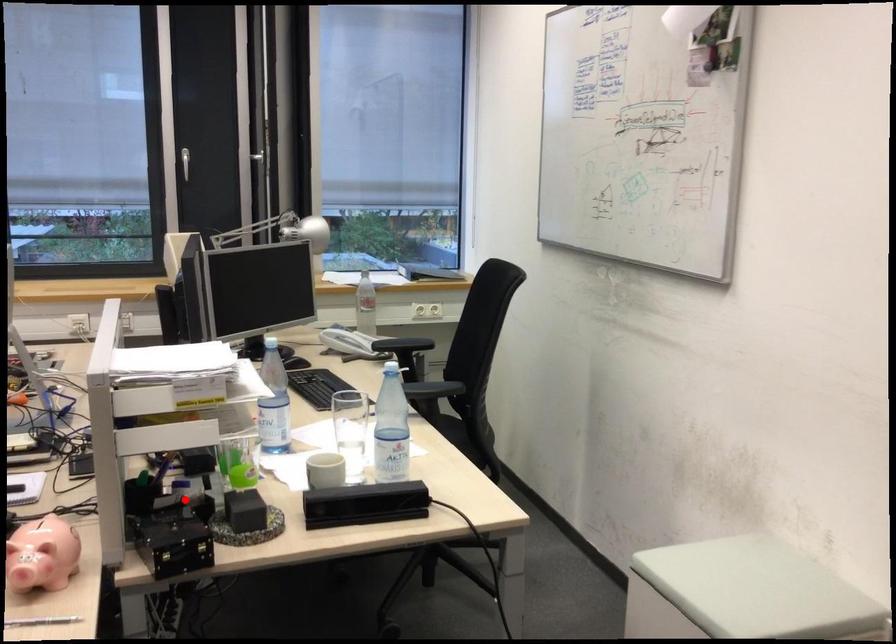
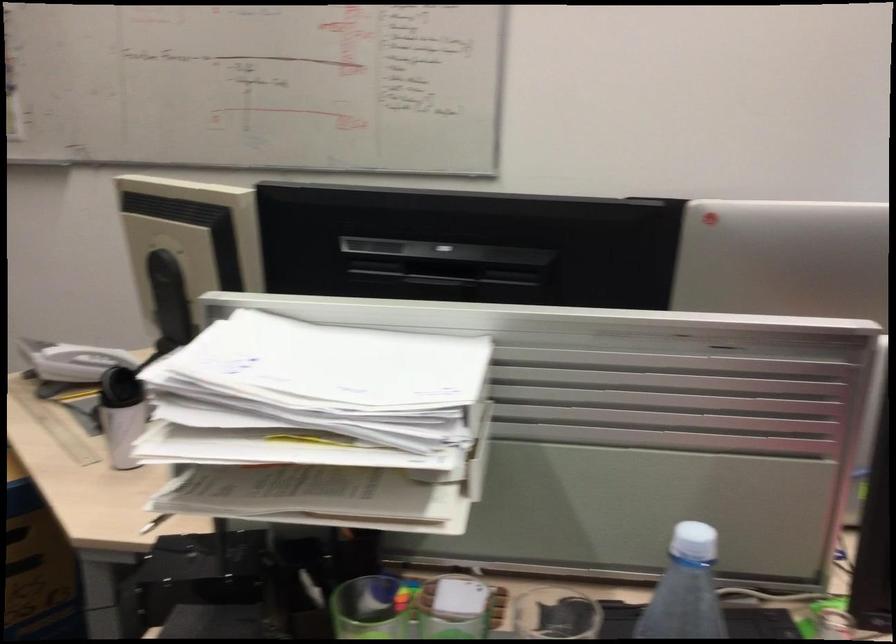
Question: I am providing you with two images of the same scene from different viewpoints. In image1, a red point is highlighted. Considering the same 3D point in image2, which of the following is correct?

Choices:
 (A) It is closer
 (B) It is farther

Answer: (A)